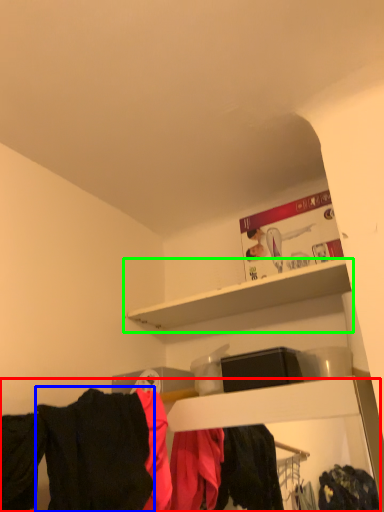
Question: Based on their relative distances, which object is nearer to closet (highlighted by a red box)? Choose from clothing (highlighted by a blue box) and shelf (highlighted by a green box).

Choices:
 (A) clothing
 (B) shelf

Answer: (A)